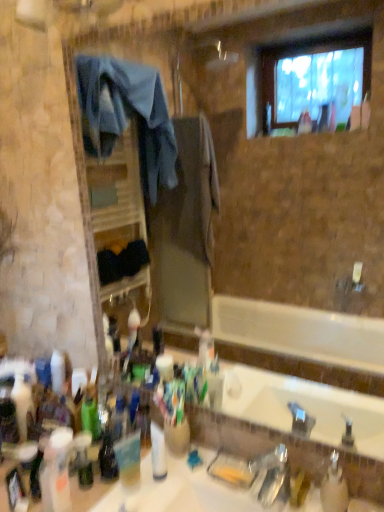
The width and height of the screenshot is (384, 512). I want to click on free point above white glossy sink at center (from a real-world perspective), so click(x=211, y=485).